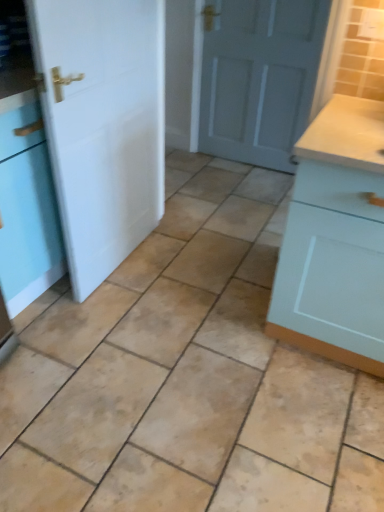
Question: Should I look upward or downward to see white matte door at left, acting as the second door starting from the back?

Choices:
 (A) down
 (B) up

Answer: (B)

Question: Does white matte door at left, acting as the second door starting from the back, have a larger size compared to beige ceramic tile at center?

Choices:
 (A) no
 (B) yes

Answer: (A)

Question: From a real-world perspective, is white matte door at left, arranged as the first door when viewed from the left, positioned over beige ceramic tile at center based on gravity?

Choices:
 (A) no
 (B) yes

Answer: (B)

Question: Does white matte door at left, acting as the second door starting from the back, have a greater height compared to beige ceramic tile at center?

Choices:
 (A) yes
 (B) no

Answer: (A)

Question: Is white matte door at left, which ranks as the 1th door in front-to-back order, positioned in front of beige ceramic tile at center?

Choices:
 (A) no
 (B) yes

Answer: (A)

Question: Is white matte door at left, which ranks as the second door in right-to-left order, oriented away from beige ceramic tile at center?

Choices:
 (A) yes
 (B) no

Answer: (B)

Question: Can you confirm if white matte door at left, arranged as the first door when viewed from the left, is wider than beige ceramic tile at center?

Choices:
 (A) yes
 (B) no

Answer: (B)

Question: From a real-world perspective, is light blue wood cabinet at right physically below beige ceramic tile at center?

Choices:
 (A) no
 (B) yes

Answer: (A)

Question: Would you say light blue wood cabinet at right is a long distance from beige ceramic tile at center?

Choices:
 (A) no
 (B) yes

Answer: (A)

Question: Can you confirm if light blue wood cabinet at right is shorter than beige ceramic tile at center?

Choices:
 (A) no
 (B) yes

Answer: (A)

Question: From the image's perspective, is light blue wood cabinet at right located beneath beige ceramic tile at center?

Choices:
 (A) no
 (B) yes

Answer: (A)

Question: Is light blue wood cabinet at right taller than beige ceramic tile at center?

Choices:
 (A) no
 (B) yes

Answer: (B)

Question: Is light blue wood cabinet at right oriented away from beige ceramic tile at center?

Choices:
 (A) no
 (B) yes

Answer: (A)

Question: Can you confirm if matte gray door at center, the second door viewed from the front, is shorter than white matte door at left, which ranks as the 1th door in front-to-back order?

Choices:
 (A) yes
 (B) no

Answer: (A)